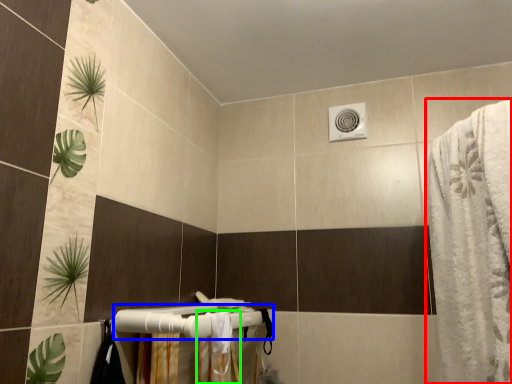
Question: Estimate the real-world distances between objects in this image. Which object is farther from bath towel (highlighted by a red box), towel bar (highlighted by a blue box) or shower curtain (highlighted by a green box)?

Choices:
 (A) towel bar
 (B) shower curtain

Answer: (A)